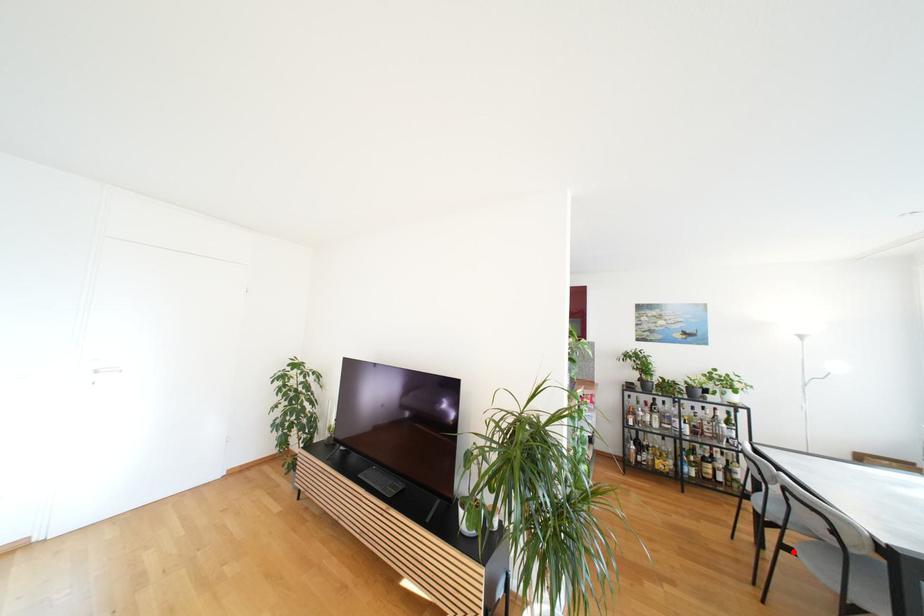
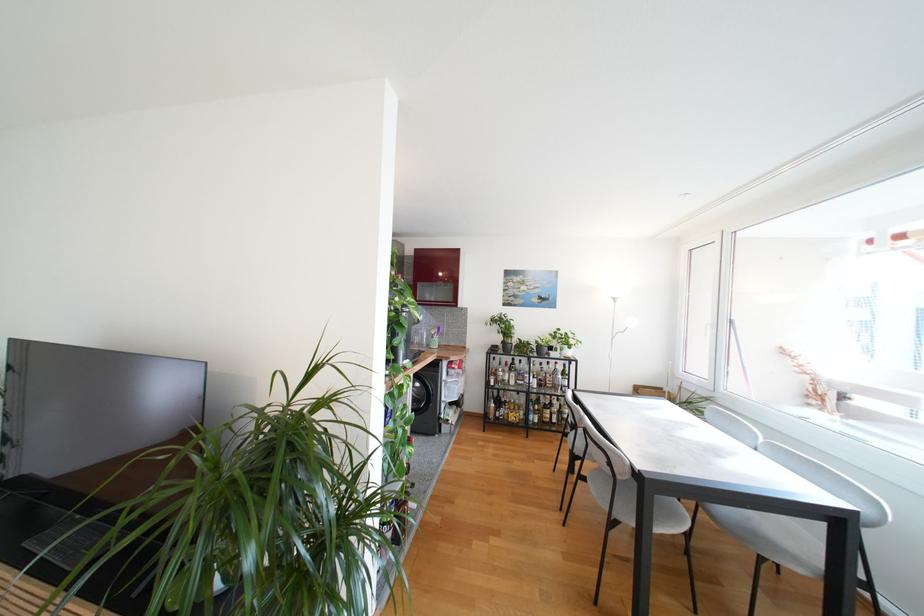
The point at the highlighted location is marked in the first image. Where is the corresponding point in the second image?

(589, 480)